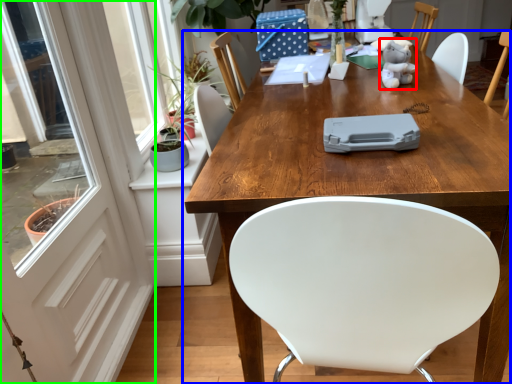
Question: Estimate the real-world distances between objects in this image. Which object is farther from toy (highlighted by a red box), table (highlighted by a blue box) or screen door (highlighted by a green box)?

Choices:
 (A) table
 (B) screen door

Answer: (B)